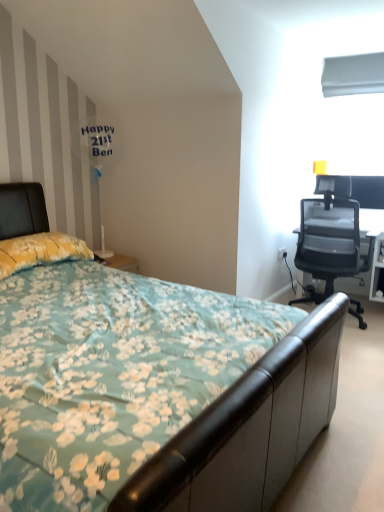
Question: Should I look upward or downward to see transparent mesh office chair at right?

Choices:
 (A) down
 (B) up

Answer: (B)

Question: Should I look upward or downward to see white smooth plastic at upper right?

Choices:
 (A) up
 (B) down

Answer: (A)

Question: From the image's perspective, does transparent mesh office chair at right appear lower than white smooth plastic at upper right?

Choices:
 (A) no
 (B) yes

Answer: (B)

Question: Does transparent mesh office chair at right have a greater width compared to white smooth plastic at upper right?

Choices:
 (A) no
 (B) yes

Answer: (B)

Question: Does transparent mesh office chair at right turn towards white smooth plastic at upper right?

Choices:
 (A) no
 (B) yes

Answer: (A)

Question: From a real-world perspective, is transparent mesh office chair at right over white smooth plastic at upper right?

Choices:
 (A) no
 (B) yes

Answer: (A)

Question: Is transparent mesh office chair at right far from white smooth plastic at upper right?

Choices:
 (A) yes
 (B) no

Answer: (A)

Question: Is transparent mesh office chair at right bigger than white smooth plastic at upper right?

Choices:
 (A) yes
 (B) no

Answer: (A)

Question: Can you confirm if floral fabric bed at center is wider than white smooth plastic at upper right?

Choices:
 (A) yes
 (B) no

Answer: (A)

Question: Is floral fabric bed at center closer to camera compared to white smooth plastic at upper right?

Choices:
 (A) yes
 (B) no

Answer: (A)

Question: Is floral fabric bed at center bigger than white smooth plastic at upper right?

Choices:
 (A) yes
 (B) no

Answer: (A)

Question: Is floral fabric bed at center facing away from white smooth plastic at upper right?

Choices:
 (A) yes
 (B) no

Answer: (B)

Question: Can you confirm if floral fabric bed at center is positioned to the right of white smooth plastic at upper right?

Choices:
 (A) yes
 (B) no

Answer: (B)

Question: Is floral fabric bed at center smaller than white smooth plastic at upper right?

Choices:
 (A) no
 (B) yes

Answer: (A)

Question: Is transparent mesh office chair at right bigger than floral fabric bed at center?

Choices:
 (A) yes
 (B) no

Answer: (B)